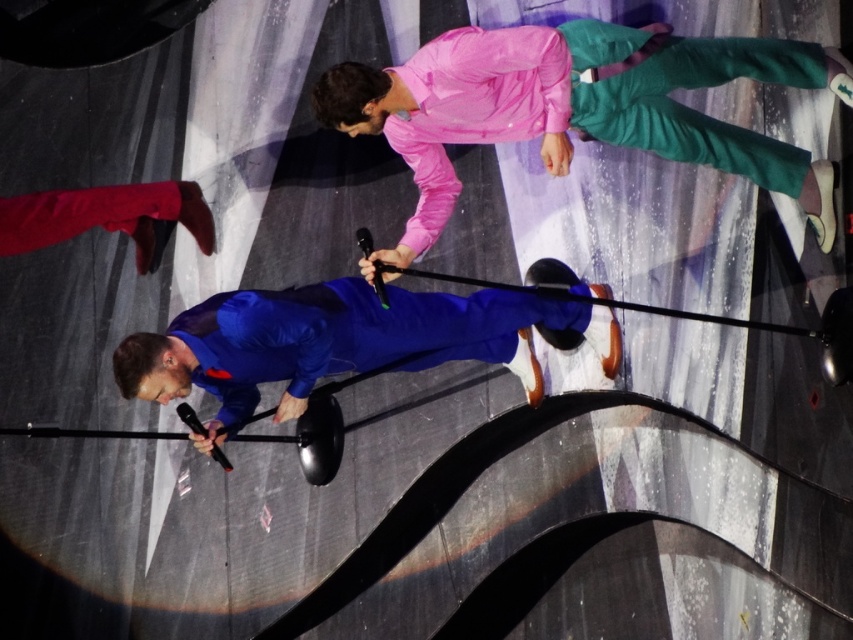
You are a photographer positioned at the back of the stage. You want to capture a clear photo of the matte blue suit at center without the pink shiny jacket at upper center blocking it. Is this possible?

The pink shiny jacket at upper center is in front of the matte blue suit at center, so it will block the view. To capture the matte blue suit at center clearly, you need to move your position to avoid the pink shiny jacket at upper center.

You are a photographer at the back of the venue. You need to capture a photo that includes both the pink shiny jacket at upper center and the matte blue suit at center. Which of the two should you focus on first to ensure they are both in frame?

You should focus on the matte blue suit at center first because it is larger in size compared to the pink shiny jacket at upper center, ensuring it fits within the frame while also capturing the smaller jacket.